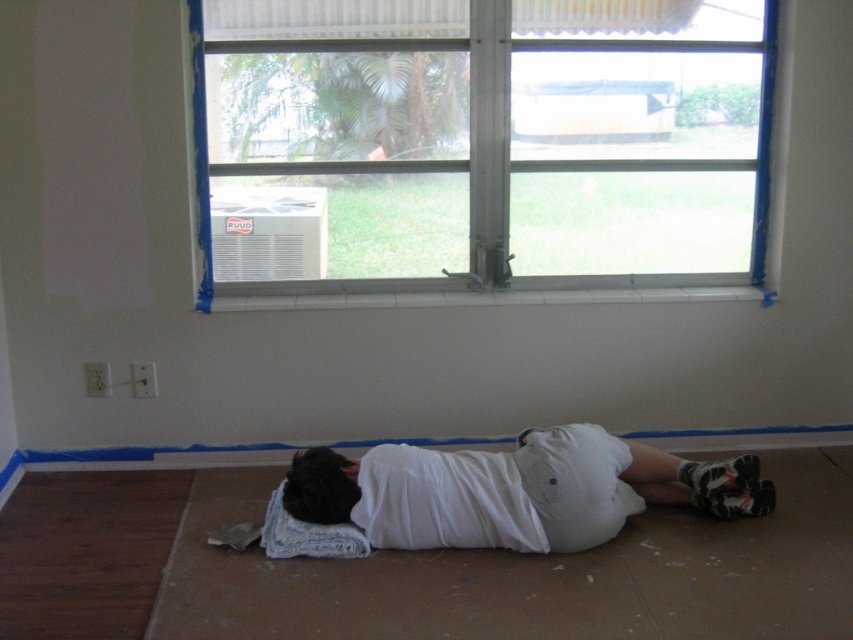
You are a painter who needs to ensure that the protective sheet on the floor is large enough to cover the area under the clear glass window at center and the white cotton shirt at lower center. Which object requires a larger protective sheet area based on their sizes?

The clear glass window at center is taller than the white cotton shirt at lower center, so it requires a larger protective sheet area.

You are a painter who needs to place a 12 inch wide painting tool between the white cotton shirt at lower center and the black fuzzy head at center. Can you fit it there?

The distance between the white cotton shirt at lower center and the black fuzzy head at center is 10.47 inches, which is less than the 12 inch width of the painting tool. Therefore, the tool cannot fit in that space.

You are a painter who needs to place a ladder in the room. The ladder is 3 meters long. You want to position it against the wall near the white cotton shirt at lower center. Is the ladder long enough to reach the ceiling?

The white cotton shirt at lower center is 2.66 meters away from the camera. Since the ladder is 3 meters long, it is slightly longer than the distance required to reach the ceiling from the position near the white cotton shirt at lower center. Therefore, the ladder is long enough to reach the ceiling.